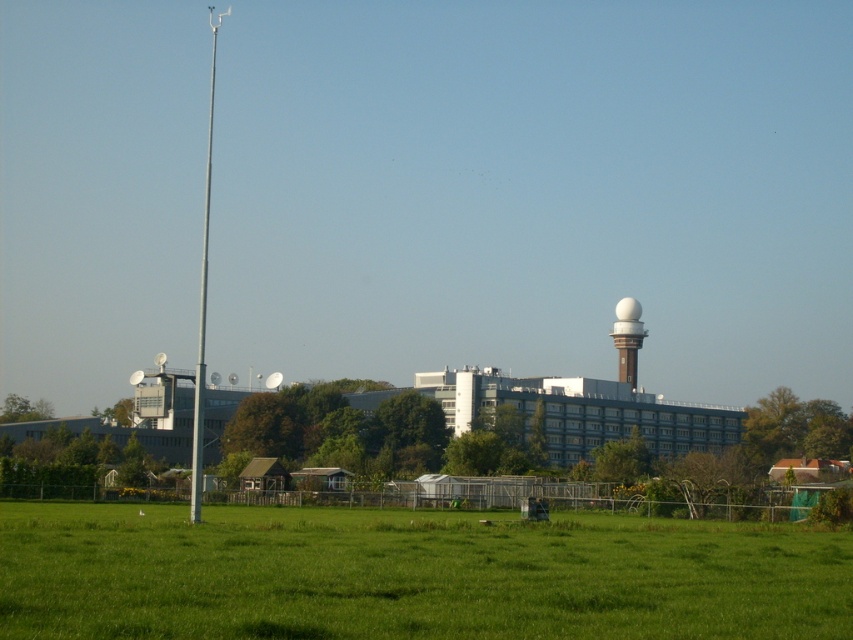
Between point (262, 605) and point (202, 288), which one is positioned behind?

Point (202, 288)

In the scene shown: How distant is green grass at lower center from silver metallic pole at left?

The distance of green grass at lower center from silver metallic pole at left is 17.14 meters.

You are a GUI agent. You are given a task and a screenshot of the screen. Output one action in this format:
    pyautogui.click(x=<x>, y=<y>)
    Task: Click on the green grass at lower center
    This screenshot has height=640, width=853.
    Given the screenshot: What is the action you would take?
    pyautogui.click(x=410, y=573)

Find the location of a particular element. The width and height of the screenshot is (853, 640). green grass at lower center is located at coordinates (410, 573).

Between silver metallic pole at left and white glossy water tower at upper center, which one is positioned higher?

silver metallic pole at left is above.

Can you confirm if silver metallic pole at left is smaller than white glossy water tower at upper center?

Incorrect, silver metallic pole at left is not smaller in size than white glossy water tower at upper center.

This screenshot has width=853, height=640. I want to click on silver metallic pole at left, so click(x=202, y=300).

From the picture: Between green grass at lower center and white glossy water tower at upper center, which one has less height?

green grass at lower center is shorter.

Does green grass at lower center appear under white glossy water tower at upper center?

Indeed, green grass at lower center is positioned under white glossy water tower at upper center.

Is point (466, 566) positioned in front of point (625, 376)?

Yes, point (466, 566) is in front of point (625, 376).

Image resolution: width=853 pixels, height=640 pixels. Identify the location of green grass at lower center. (410, 573).